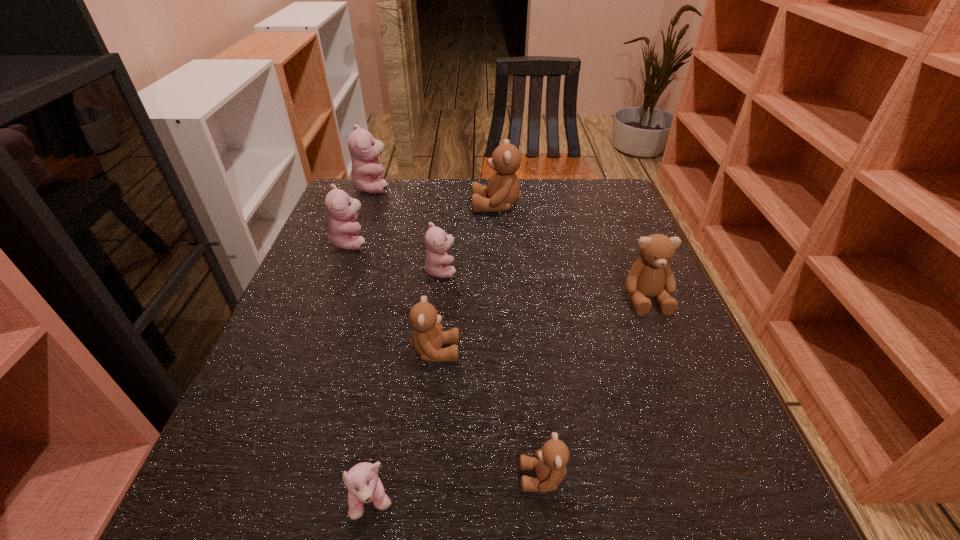
The width and height of the screenshot is (960, 540). What are the coordinates of `free space located on the front-facing side of the smallest brown teddy bear` in the screenshot? It's located at (473, 477).

Find the location of `free space located on the front-facing side of the smallest brown teddy bear`. free space located on the front-facing side of the smallest brown teddy bear is located at coordinates (266, 477).

Where is `vacant space located on the front-facing side of the smallest brown teddy bear`? vacant space located on the front-facing side of the smallest brown teddy bear is located at coordinates tap(379, 477).

Identify the location of object located in the right edge section of the desktop. (651, 275).

The height and width of the screenshot is (540, 960). What are the coordinates of `object positioned at the far left corner` in the screenshot? It's located at (366, 175).

The image size is (960, 540). In order to click on free space at the far edge of the desktop in this screenshot , I will do `click(447, 208)`.

Where is `vacant space at the near edge of the desktop`? This screenshot has width=960, height=540. vacant space at the near edge of the desktop is located at coordinates tap(633, 528).

Where is `free space at the left edge of the desktop`? free space at the left edge of the desktop is located at coordinates (261, 423).

This screenshot has height=540, width=960. What are the coordinates of `vacant space at the right edge of the desktop` in the screenshot? It's located at (598, 230).

Locate an element on the screen. Image resolution: width=960 pixels, height=540 pixels. free point at the near left corner is located at coordinates (200, 498).